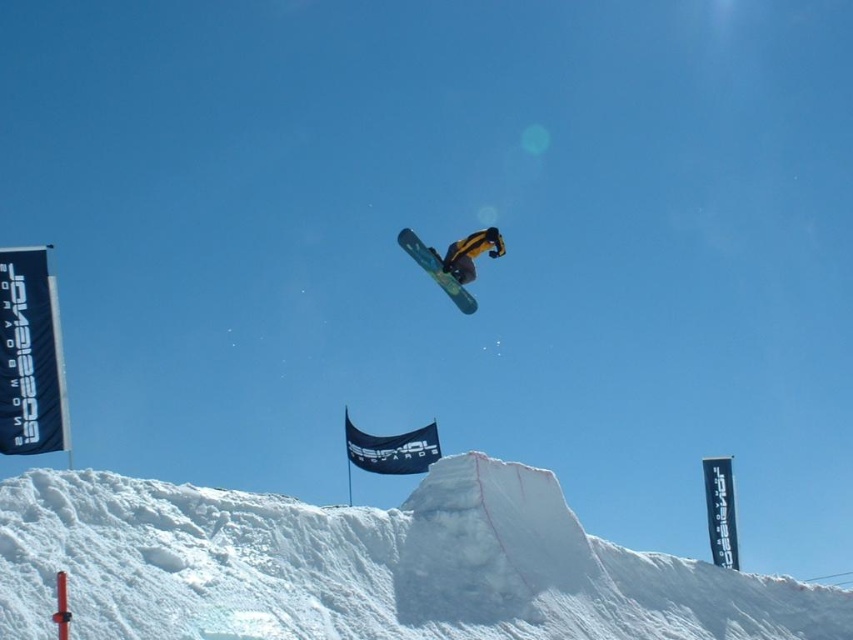
Is white fluffy snow at center further to the viewer compared to yellow matte snowboarder at center?

No, it is not.

Where is `white fluffy snow at center`? The height and width of the screenshot is (640, 853). white fluffy snow at center is located at coordinates (367, 566).

Where is `white fluffy snow at center`? This screenshot has width=853, height=640. white fluffy snow at center is located at coordinates (367, 566).

You are a GUI agent. You are given a task and a screenshot of the screen. Output one action in this format:
    pyautogui.click(x=<x>, y=<y>)
    Task: Click on the white fluffy snow at center
    The height and width of the screenshot is (640, 853).
    Given the screenshot: What is the action you would take?
    pyautogui.click(x=367, y=566)

Can you confirm if white fluffy snow at center is positioned above blue matte snowboard at center?

Incorrect, white fluffy snow at center is not positioned above blue matte snowboard at center.

Does point (708, 586) come in front of point (431, 250)?

No, it is behind (431, 250).

Locate an element on the screen. The width and height of the screenshot is (853, 640). white fluffy snow at center is located at coordinates (367, 566).

Which is more to the left, blue matte snowboard at center or yellow matte snowboarder at center?

Positioned to the left is blue matte snowboard at center.

Is blue matte snowboard at center below yellow matte snowboarder at center?

Actually, blue matte snowboard at center is above yellow matte snowboarder at center.

Locate an element on the screen. This screenshot has width=853, height=640. blue matte snowboard at center is located at coordinates (436, 269).